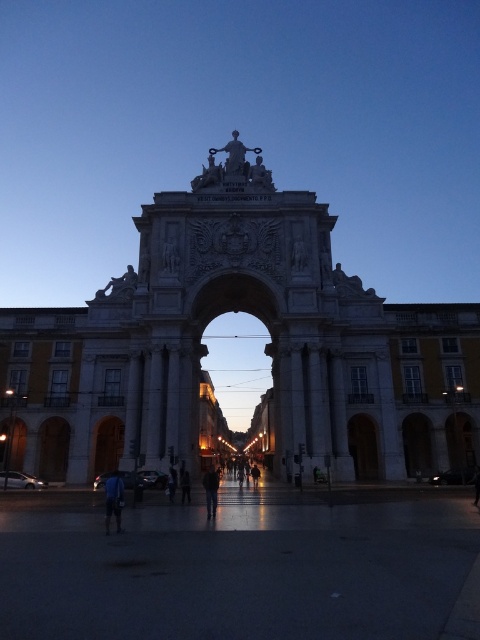
Does blue fabric at lower left have a larger size compared to dark blue fabric at center?

Yes, blue fabric at lower left is bigger than dark blue fabric at center.

Does point (119, 528) come in front of point (212, 477)?

Yes, it is in front of point (212, 477).

Identify the location of blue fabric at lower left. The height and width of the screenshot is (640, 480). (113, 500).